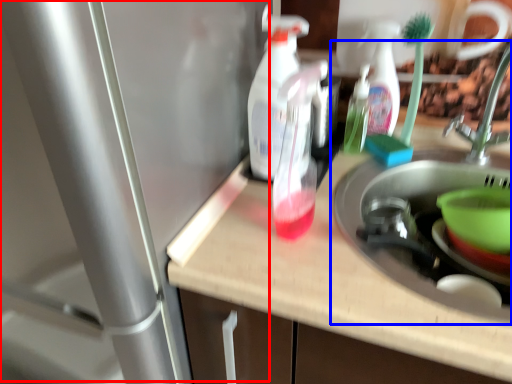
Question: Which object appears farthest to the camera in this image, water heater (highlighted by a red box) or sink (highlighted by a blue box)?

Choices:
 (A) water heater
 (B) sink

Answer: (B)